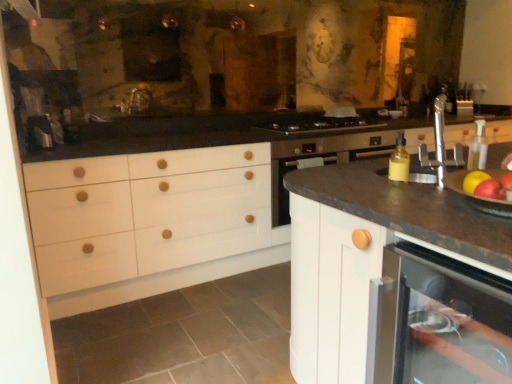
Identify the location of free space to the left of red matte apple at right, which is the 1th apple from front to back. This screenshot has width=512, height=384. coord(411,208).